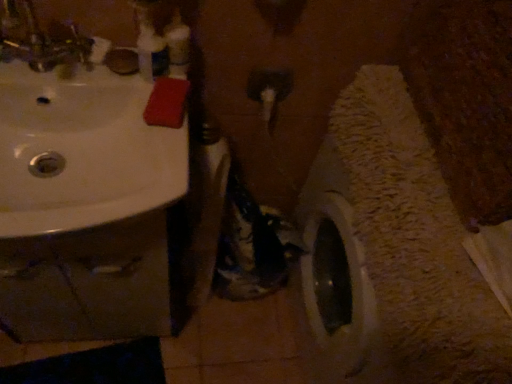
Question: Should I look upward or downward to see white glossy sink at upper left?

Choices:
 (A) up
 (B) down

Answer: (A)

Question: From the image's perspective, is brushed metal faucet at upper left above translucent plastic bottle at upper center?

Choices:
 (A) no
 (B) yes

Answer: (A)

Question: Is brushed metal faucet at upper left further to the viewer compared to translucent plastic bottle at upper center?

Choices:
 (A) yes
 (B) no

Answer: (B)

Question: Can you confirm if brushed metal faucet at upper left is positioned to the left of translucent plastic bottle at upper center?

Choices:
 (A) no
 (B) yes

Answer: (B)

Question: Can you confirm if brushed metal faucet at upper left is smaller than translucent plastic bottle at upper center?

Choices:
 (A) yes
 (B) no

Answer: (B)

Question: Is brushed metal faucet at upper left wider than translucent plastic bottle at upper center?

Choices:
 (A) no
 (B) yes

Answer: (B)

Question: From a real-world perspective, is brushed metal faucet at upper left located higher than translucent plastic bottle at upper center?

Choices:
 (A) yes
 (B) no

Answer: (A)

Question: Is white glossy sink at upper left taller than brushed metal faucet at upper left?

Choices:
 (A) no
 (B) yes

Answer: (A)

Question: Does white glossy sink at upper left appear on the right side of brushed metal faucet at upper left?

Choices:
 (A) yes
 (B) no

Answer: (A)

Question: Is white glossy sink at upper left thinner than brushed metal faucet at upper left?

Choices:
 (A) no
 (B) yes

Answer: (A)

Question: Would you say brushed metal faucet at upper left is part of white glossy sink at upper left's contents?

Choices:
 (A) no
 (B) yes

Answer: (A)

Question: Does white glossy sink at upper left have a greater width compared to brushed metal faucet at upper left?

Choices:
 (A) yes
 (B) no

Answer: (A)

Question: Is the position of white glossy sink at upper left more distant than that of brushed metal faucet at upper left?

Choices:
 (A) yes
 (B) no

Answer: (A)

Question: Is translucent plastic bottle at upper center oriented towards brushed metal faucet at upper left?

Choices:
 (A) no
 (B) yes

Answer: (A)